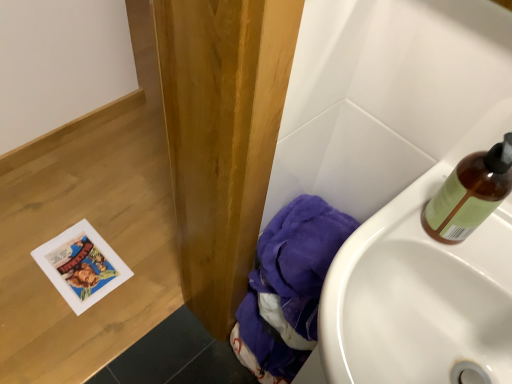
Question: In the image, is white glossy sink at lower right positioned in front of or behind translucent amber bottle at upper right?

Choices:
 (A) behind
 (B) front

Answer: (B)

Question: From a real-world perspective, is white glossy sink at lower right positioned above or below translucent amber bottle at upper right?

Choices:
 (A) above
 (B) below

Answer: (B)

Question: Estimate the real-world distances between objects in this image. Which object is farther from the purple fabric at lower right?

Choices:
 (A) translucent amber bottle at upper right
 (B) white glossy sink at lower right

Answer: (A)

Question: Considering the real-world distances, which object is closest to the white glossy sink at lower right?

Choices:
 (A) translucent amber bottle at upper right
 (B) purple fabric at lower right

Answer: (A)